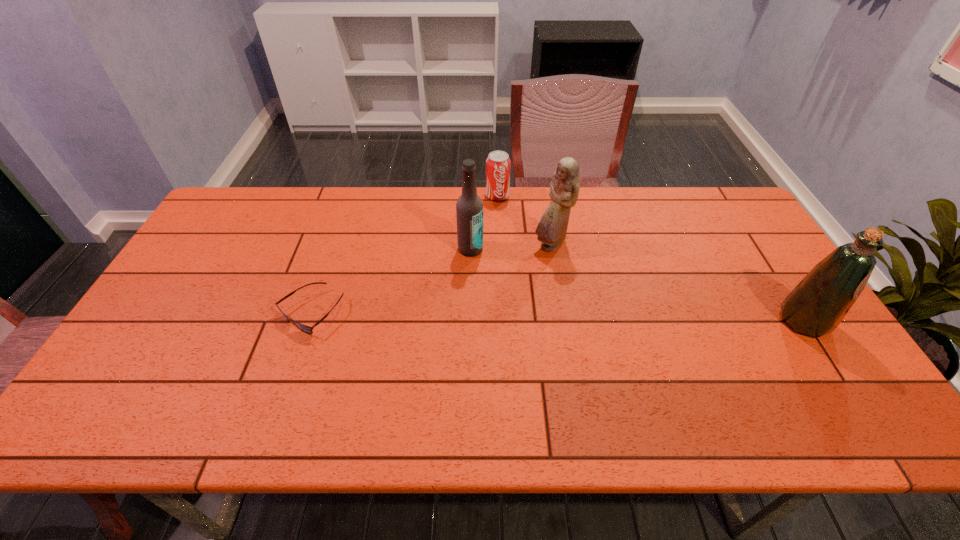
The image size is (960, 540). Find the location of `free space between the third object from right to left and the fourth object from right to left`. free space between the third object from right to left and the fourth object from right to left is located at coordinates (484, 222).

Locate an element on the screen. vacant region between the beer bottle and the second object from right to left is located at coordinates (511, 247).

In order to click on vacant space that is in between the olive oil and the leftmost object in this screenshot , I will do `click(558, 316)`.

What are the coordinates of `free space between the rightmost object and the leftmost object` in the screenshot? It's located at (558, 316).

This screenshot has height=540, width=960. I want to click on vacant space that's between the sunglasses and the soda can, so click(404, 254).

I want to click on free space between the rightmost object and the soda can, so click(650, 258).

At what (x,y) coordinates should I click in order to perform the action: click on object that ranks as the fourth closest to the sunglasses. Please return your answer as a coordinate pair (x, y). The image size is (960, 540). Looking at the image, I should click on (816, 306).

Where is `object that is the closest to the second object from right to left`? The image size is (960, 540). object that is the closest to the second object from right to left is located at coordinates (469, 208).

Locate an element on the screen. This screenshot has height=540, width=960. vacant space that satisfies the following two spatial constraints: 1. on the front side of the fourth tallest object; 2. on the front-facing side of the rightmost object is located at coordinates (503, 321).

Where is `free space that satisfies the following two spatial constraints: 1. at the front of the sunglasses showing the lenses; 2. on the front-facing side of the rightmost object`? The height and width of the screenshot is (540, 960). free space that satisfies the following two spatial constraints: 1. at the front of the sunglasses showing the lenses; 2. on the front-facing side of the rightmost object is located at coordinates (308, 321).